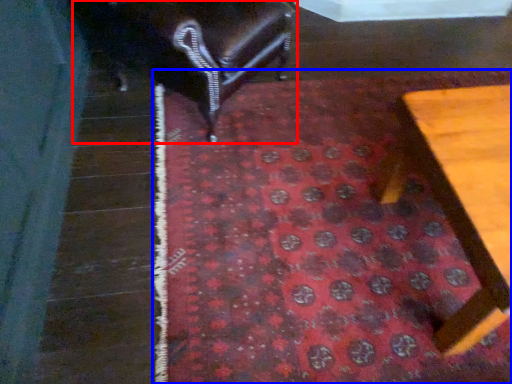
Question: Which of the following is the closest to the observer, furniture (highlighted by a red box) or mat (highlighted by a blue box)?

Choices:
 (A) furniture
 (B) mat

Answer: (B)